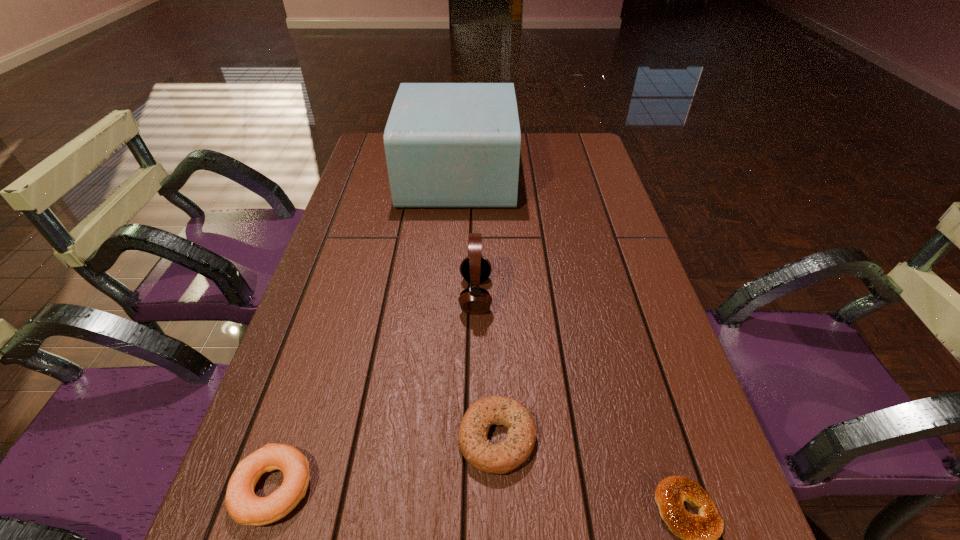
Where is `free space that satisfies the following two spatial constraints: 1. on the ear pads of the second farthest object; 2. on the left side of the second bagel from left to right`? free space that satisfies the following two spatial constraints: 1. on the ear pads of the second farthest object; 2. on the left side of the second bagel from left to right is located at coordinates (474, 437).

The height and width of the screenshot is (540, 960). I want to click on vacant area in the image that satisfies the following two spatial constraints: 1. on the front panel of the second bagel from left to right; 2. on the right side of the tallest object, so click(x=441, y=437).